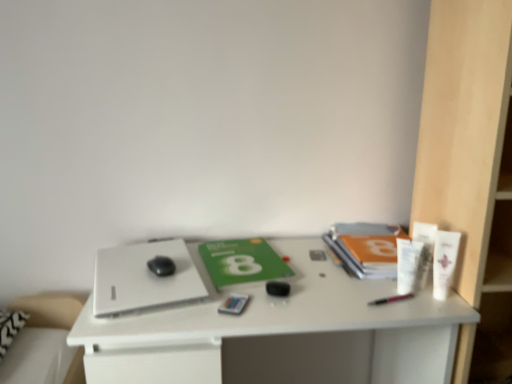
The width and height of the screenshot is (512, 384). What are the coordinates of `vacant space that's between matte plastic card at center, which appears as the first stationery when viewed from the left, and white matte tube at upper right, which is the 3th toiletry from left to right` in the screenshot? It's located at (325, 302).